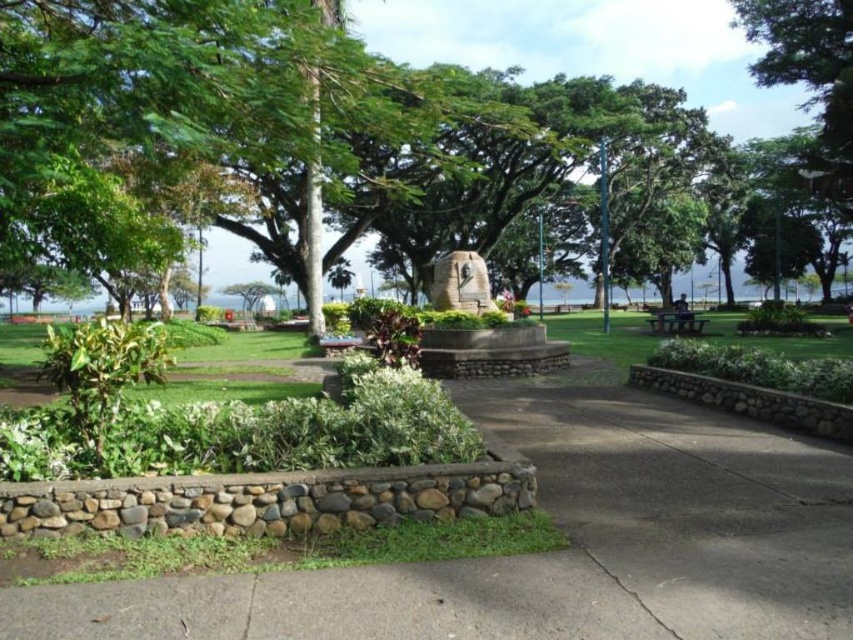
You are standing in the park and see two points marked in the image. Which point is closer to you, point (457, 301) or point (691, 317)?

Point (457, 301) is closer to the viewer than point (691, 317).

You are a park visitor who wants to take a photo of the rustic stone monument at center from the wooden park bench at center. Considering the distance between them, will you be able to capture the entire monument in your camera frame without moving closer?

The distance between rustic stone monument at center and wooden park bench at center is 12.37 meters. Depending on your camera lens, capturing the entire monument may require a wide angle or zooming out, but the distance itself does not prevent capturing it as 12.37 meters is a standard shooting distance.

You are standing at the entrance of the park and see the green stone bench at center and the green leafy tree at center. Which object is positioned to the left when facing the monument?

The green stone bench at center is to the left of the green leafy tree at center when facing the monument.